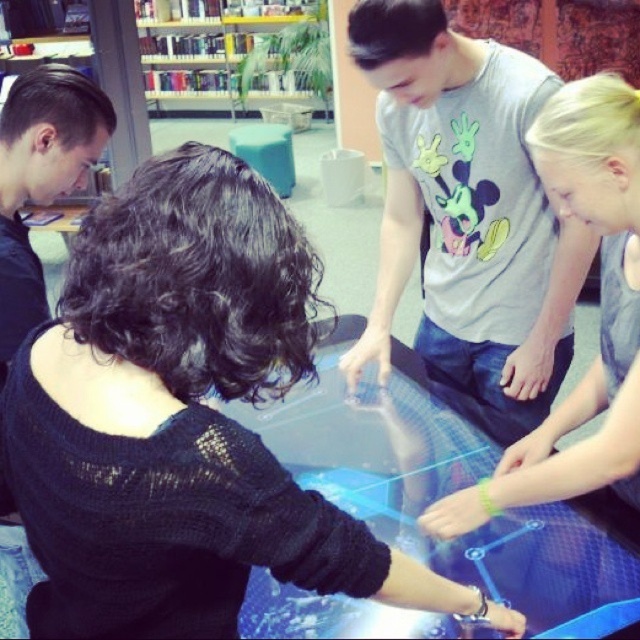
Does transparent plastic table at center have a greater height compared to wooden bookshelf at upper center?

Incorrect, transparent plastic table at center's height is not larger of wooden bookshelf at upper center's.

This screenshot has height=640, width=640. What are the coordinates of `transparent plastic table at center` in the screenshot? It's located at (448, 486).

Identify the location of transparent plastic table at center. (448, 486).

Does point (305, 632) come closer to viewer compared to point (632, 96)?

No, it is not.

Between transparent plastic table at center and gray fabric shirt at center, which one appears on the left side from the viewer's perspective?

transparent plastic table at center is more to the left.

Who is more distant from viewer, (392,493) or (449,513)?

The point (392,493) is behind.

Where is `transparent plastic table at center`? transparent plastic table at center is located at coordinates (448, 486).

Who is higher up, gray cotton shirt at center or gray fabric shirt at center?

gray cotton shirt at center is higher up.

Is point (483, 51) in front of point (636, 404)?

No, it is behind (636, 404).

Is point (376, 291) behind point (576, 493)?

Yes, point (376, 291) is behind point (576, 493).

Locate an element on the screen. The width and height of the screenshot is (640, 640). gray cotton shirt at center is located at coordinates (467, 216).